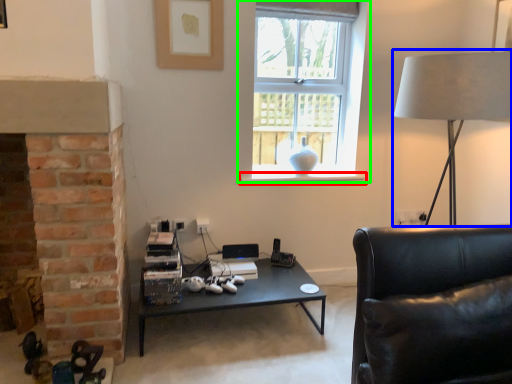
Question: Estimate the real-world distances between objects in this image. Which object is farther from window sill (highlighted by a red box), table lamp (highlighted by a blue box) or window (highlighted by a green box)?

Choices:
 (A) table lamp
 (B) window

Answer: (A)